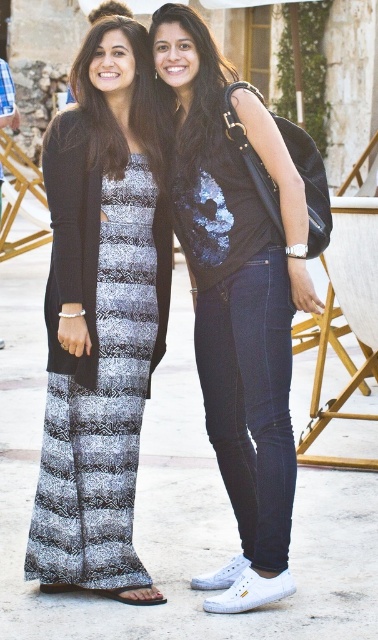
Looking at this image, you are an architect designing a new outdoor seating area. You want to place a bench exactly where the patterned fabric dress at left is standing. What are the coordinates for placing the bench?

The coordinates for placing the bench should be at point [100,316] where the patterned fabric dress at left is located.

You are standing at the origin point in the image. There are two points marked in the scene, point (97, 246) and point (278, 148). Which point is closer to you?

Point (278, 148) is closer to you because point (97, 246) is behind it.